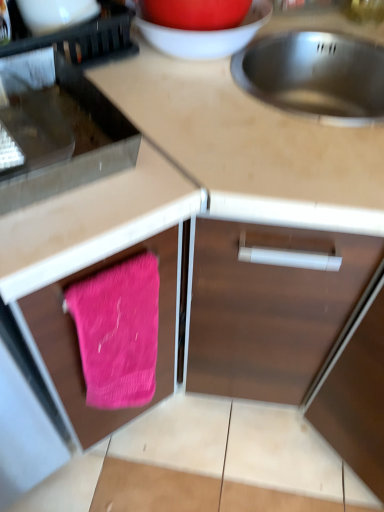
Locate an element on the screen. free location to the right of metallic stainless steel oven at left, positioned as the second appliance in top-to-bottom order is located at coordinates (200, 142).